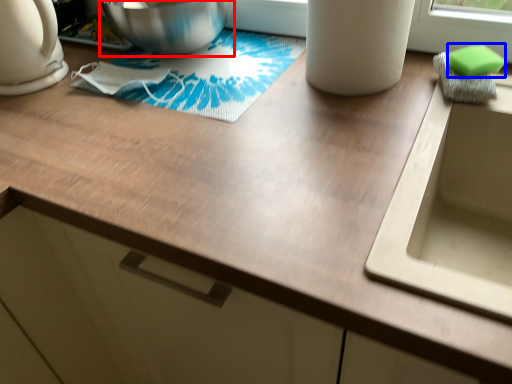
Question: Among these objects, which one is nearest to the camera, mixing bowl (highlighted by a red box) or soap (highlighted by a blue box)?

Choices:
 (A) mixing bowl
 (B) soap

Answer: (B)